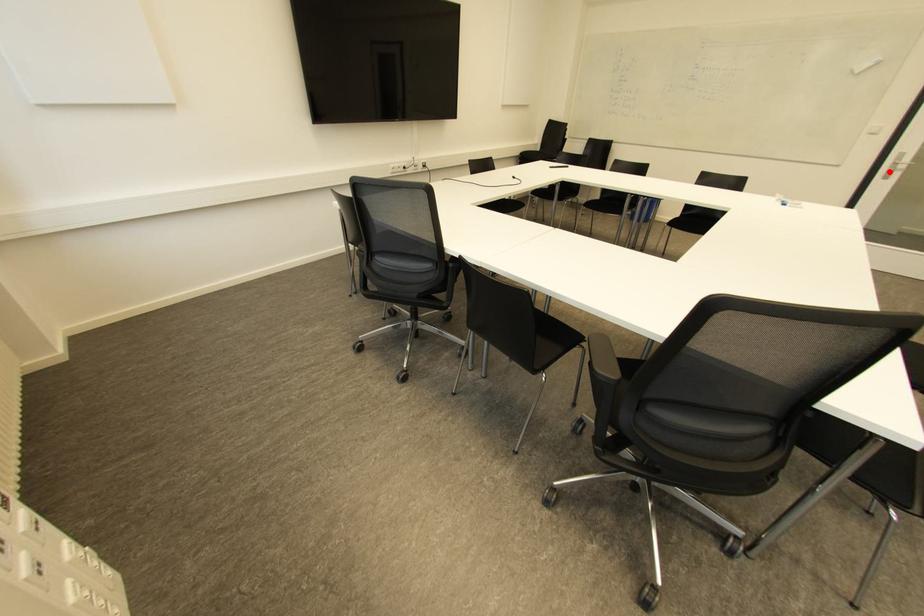
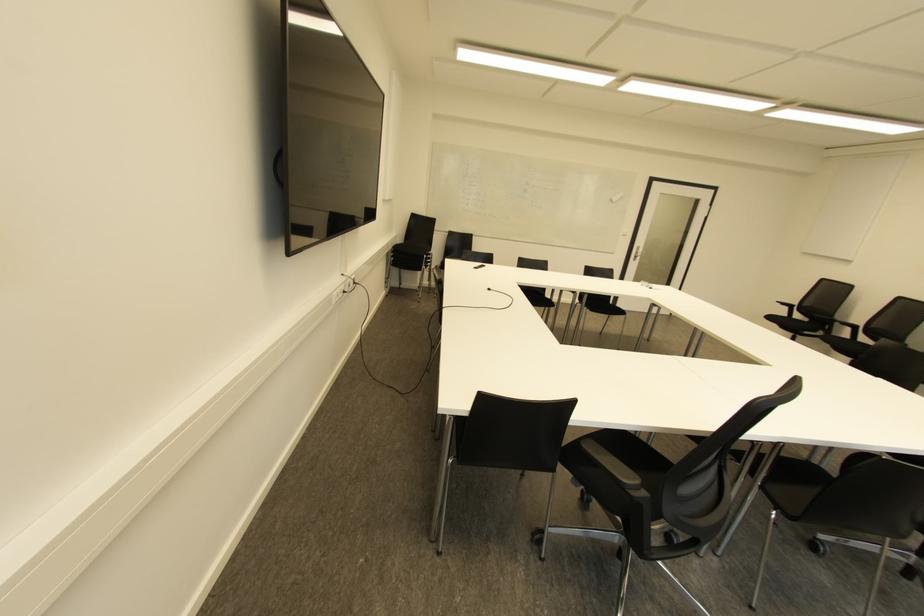
Question: I am providing you with two images of the same scene from different viewpoints. In image1, a red point is highlighted. Considering the same 3D point in image2, which of the following is correct?

Choices:
 (A) It is closer
 (B) It is farther

Answer: (A)